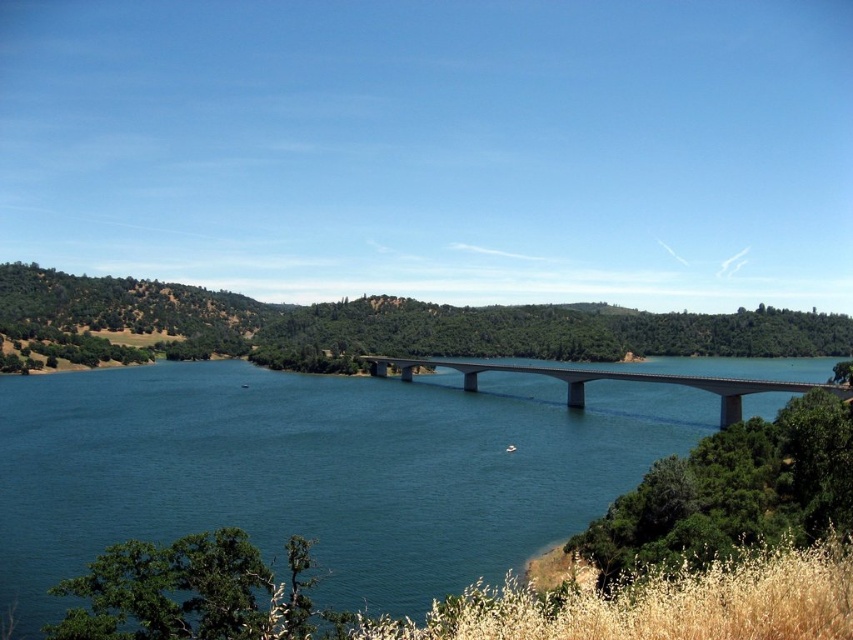
Question: Observing the image, what is the correct spatial positioning of blue smooth water at center in reference to concrete bridge at center?

Choices:
 (A) right
 (B) left

Answer: (A)

Question: Which object appears closest to the camera in this image?

Choices:
 (A) blue smooth water at center
 (B) green leafy hillside at center

Answer: (A)

Question: Which point is farther to the camera?

Choices:
 (A) blue smooth water at center
 (B) green leafy hillside at center

Answer: (B)

Question: Based on their relative distances, which object is farther from the concrete bridge at center?

Choices:
 (A) green leafy hillside at center
 (B) blue smooth water at center

Answer: (A)

Question: Is blue smooth water at center further to camera compared to concrete bridge at center?

Choices:
 (A) yes
 (B) no

Answer: (B)

Question: In this image, where is blue smooth water at center located relative to concrete bridge at center?

Choices:
 (A) right
 (B) left

Answer: (A)